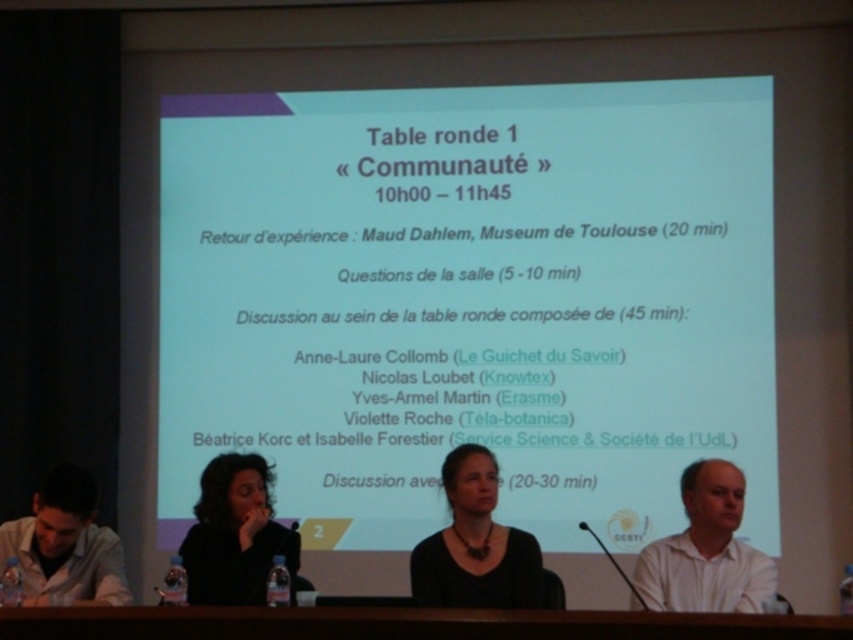
Question: From the image, what is the correct spatial relationship of matte black necklace at center in relation to white matte shirt at lower right?

Choices:
 (A) left
 (B) right

Answer: (A)

Question: Observing the image, what is the correct spatial positioning of brown wooden table at lower center in reference to white matte shirt at lower right?

Choices:
 (A) below
 (B) above

Answer: (A)

Question: Which point is closer to the camera?

Choices:
 (A) white matte projector screen at upper center
 (B) matte white shirt at lower left
 (C) matte black hair at lower left
 (D) white matte shirt at lower right

Answer: (B)

Question: Among these points, which one is farthest from the camera?

Choices:
 (A) (233, 520)
 (B) (335, 300)
 (C) (38, 564)

Answer: (B)

Question: Which object appears farthest from the camera in this image?

Choices:
 (A) matte black hair at lower left
 (B) white matte shirt at lower right

Answer: (B)

Question: Is brown wooden table at lower center above white matte shirt at lower right?

Choices:
 (A) no
 (B) yes

Answer: (A)